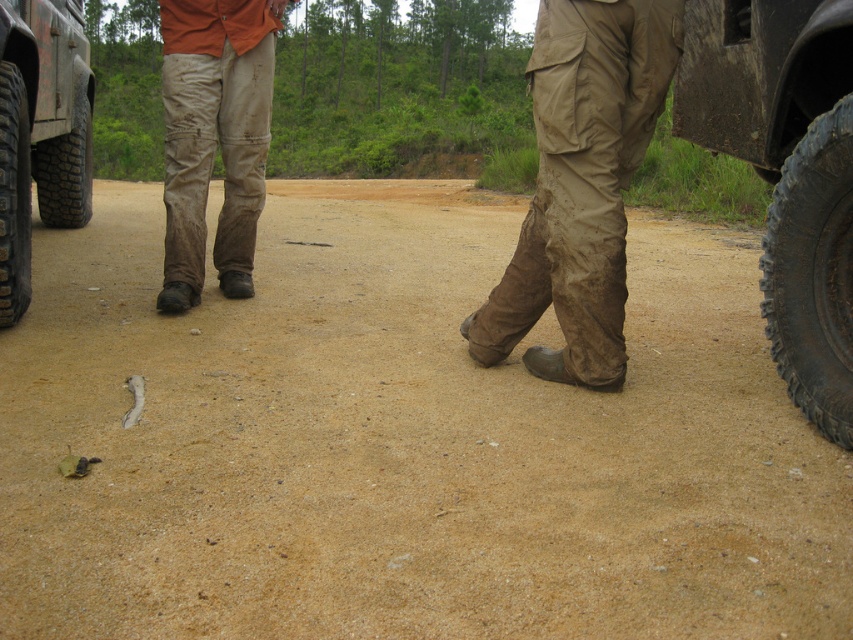
Can you confirm if worn canvas pants at center is positioned below black rubber tire at left?

Indeed, worn canvas pants at center is positioned under black rubber tire at left.

From the picture: Does worn canvas pants at center have a lesser width compared to black rubber tire at left?

No, worn canvas pants at center is not thinner than black rubber tire at left.

Locate an element on the screen. The image size is (853, 640). worn canvas pants at center is located at coordinates (581, 182).

Is black rubber tire at right wider than rubber/rough tire at left?

In fact, black rubber tire at right might be narrower than rubber/rough tire at left.

Between point (772, 339) and point (9, 106), which one is positioned behind?

Point (9, 106)

Locate an element on the screen. The image size is (853, 640). black rubber tire at right is located at coordinates (813, 273).

Is rubber tread tire at right shorter than black rugged tire at left?

Incorrect, rubber tread tire at right's height does not fall short of black rugged tire at left's.

Who is lower down, rubber tread tire at right or black rugged tire at left?

rubber tread tire at right

Where is `rubber tread tire at right`? The height and width of the screenshot is (640, 853). rubber tread tire at right is located at coordinates (x=786, y=172).

Where is `rubber tread tire at right`? rubber tread tire at right is located at coordinates (786, 172).